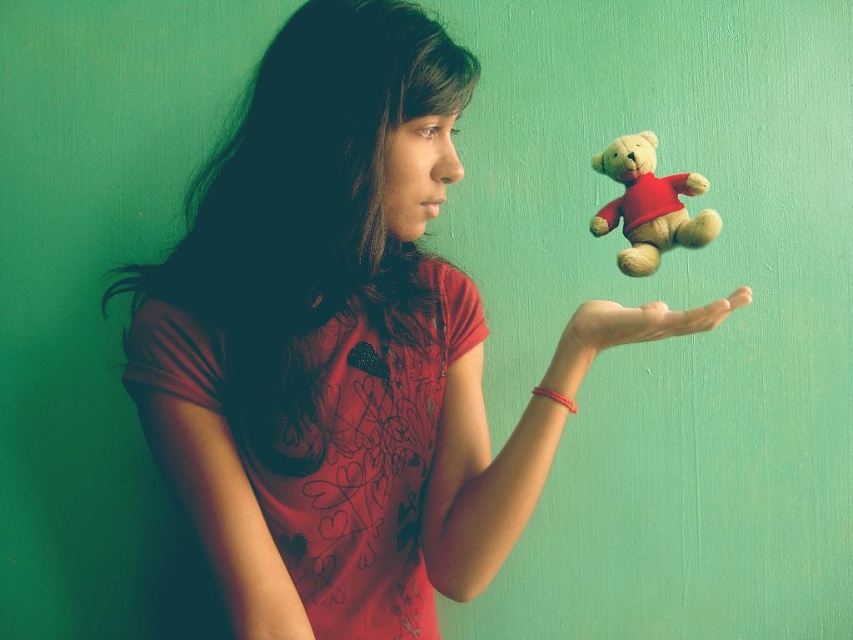
You are a photographer standing 3 feet away from the velvet beige teddy bear at center in the image. Can you comfortably take a photo of the teddy bear without moving closer?

The velvet beige teddy bear at center is 39.01 inches away from the viewer. Since 3 feet equals 36 inches, the distance between you and the teddy bear is 39.01 inches, which is slightly farther than 3 feet. Therefore, you can comfortably take a photo without moving closer as the distance is sufficient for a clear shot.

You are an artist trying to sketch the teddy bear in the image. The teddy bear is located at point [648,205]. What color is the teddy bear?

The teddy bear at point [648,205] is velvet beige.